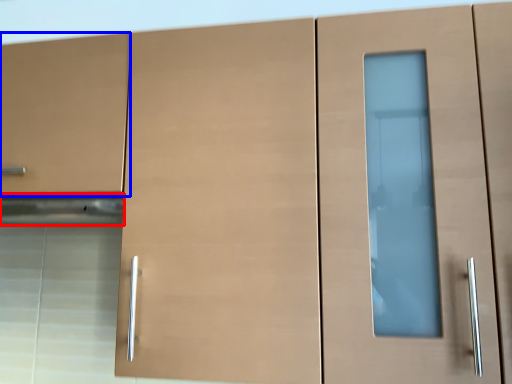
Question: Which object is further to the camera taking this photo, exhaust hood (highlighted by a red box) or drawer (highlighted by a blue box)?

Choices:
 (A) exhaust hood
 (B) drawer

Answer: (A)